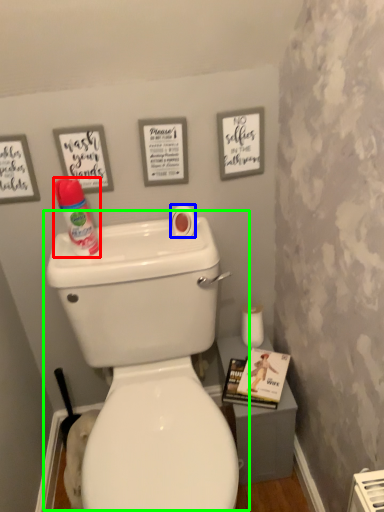
Question: Which object is positioned closest to cleaning product (highlighted by a red box)? Select from toilet paper (highlighted by a blue box) and toilet (highlighted by a green box).

Choices:
 (A) toilet paper
 (B) toilet

Answer: (A)